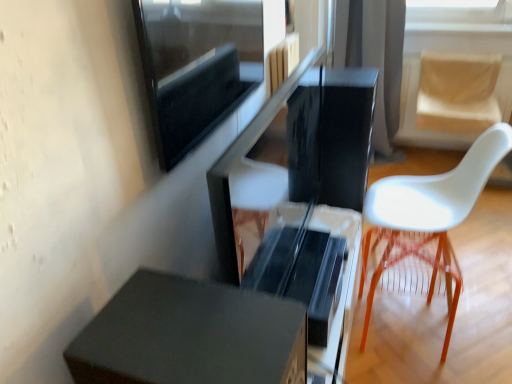
I want to click on vacant area that lies between white plastic chair at right and translucent orange stool at right, so click(457, 337).